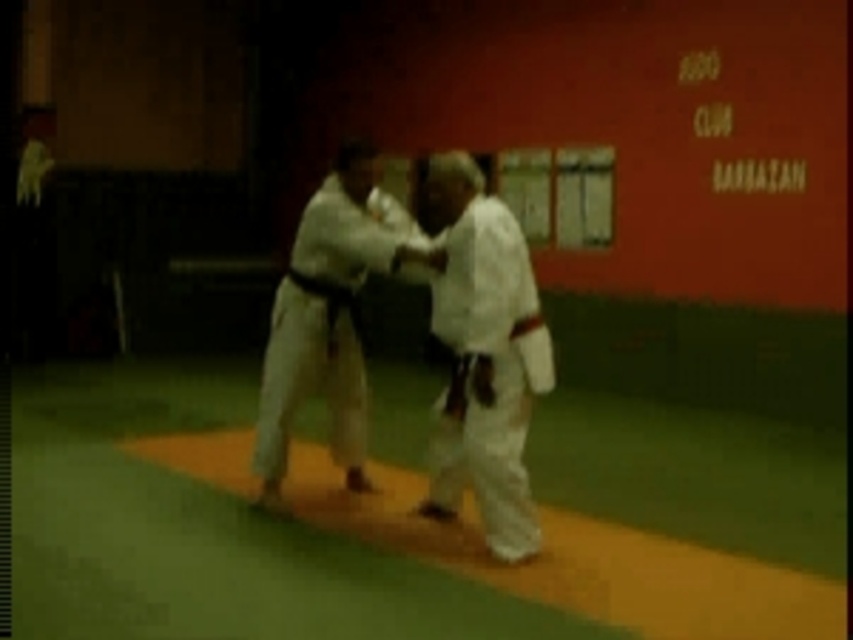
You are a judo instructor observing a practice session in the dojo. You notice two participants wearing white cloth kimono at center and white karate gi at center. Which one is positioned higher in the image?

The white cloth kimono at center is positioned higher than the white karate gi at center.

You are a judo instructor observing a training session in the dojo. You notice two practitioners wearing white cloth kimono at center and white karate gi at center. Which clothing item is shorter?

The white cloth kimono at center is shorter than the white karate gi at center.

You are a photographer setting up for a judo competition. You need to position your camera to capture both the white cloth kimono at center and the white karate gi at center clearly. Based on their positions, which one should you focus on first to ensure both are in frame?

The white cloth kimono at center is to the right of the white karate gi at center. Therefore, you should focus on the white karate gi at center first, as it is on the left side, ensuring the camera captures both from left to right.